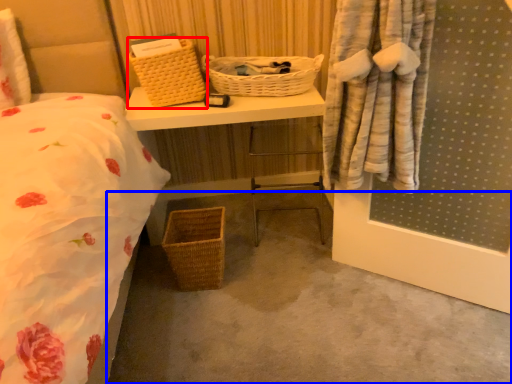
Question: Which of the following is the closest to the observer, picnic basket (highlighted by a red box) or concrete (highlighted by a blue box)?

Choices:
 (A) picnic basket
 (B) concrete

Answer: (B)